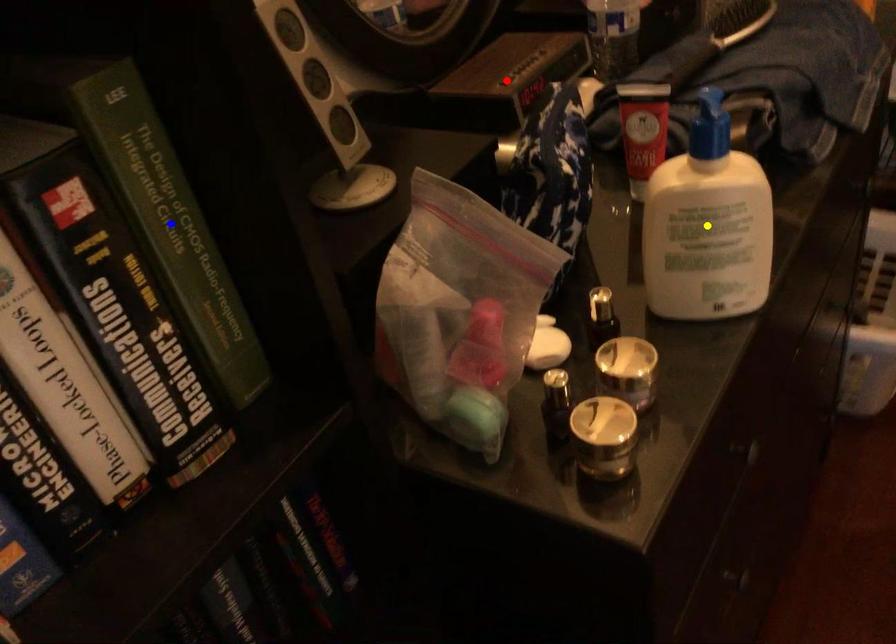
In the scene shown: Order these from nearest to farthest:
yellow point | blue point | red point

red point → yellow point → blue point